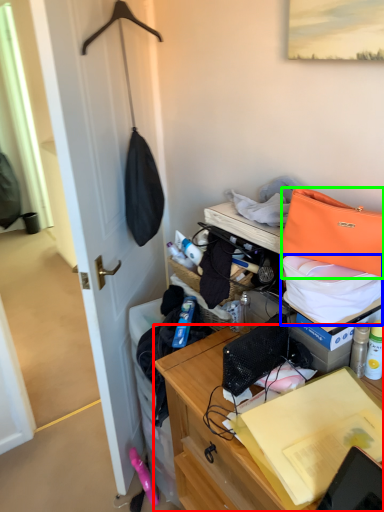
Question: Based on their relative distances, which object is farther from desk (highlighted by a red box)? Choose from kit (highlighted by a blue box) and handbag (highlighted by a green box).

Choices:
 (A) kit
 (B) handbag

Answer: (B)